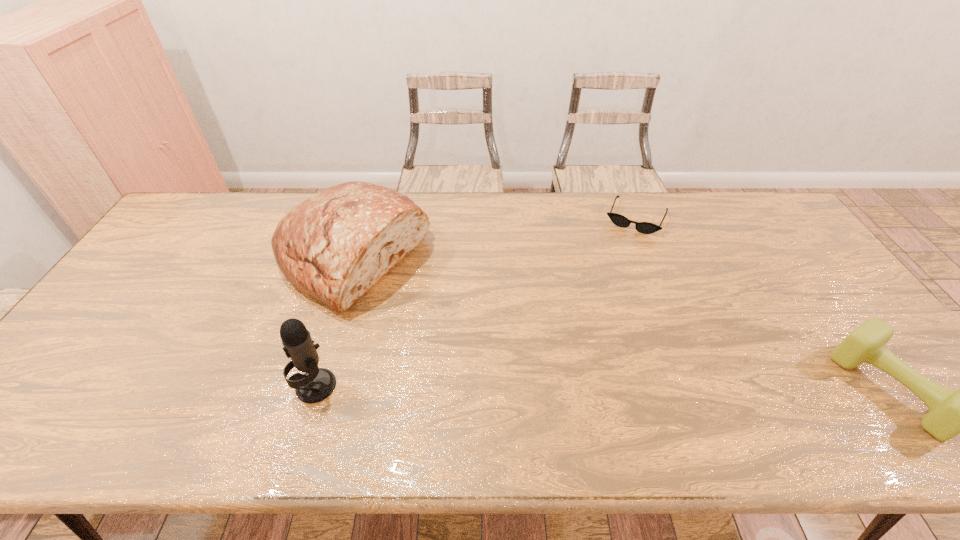
Identify the location of microphone. The width and height of the screenshot is (960, 540). (317, 384).

The image size is (960, 540). Find the location of `bread`. bread is located at coordinates (335, 246).

Image resolution: width=960 pixels, height=540 pixels. I want to click on sunglasses, so pyautogui.click(x=619, y=220).

The height and width of the screenshot is (540, 960). I want to click on the shortest object, so click(619, 220).

Image resolution: width=960 pixels, height=540 pixels. In order to click on blank space located 0.140m on the left of the microphone in this screenshot , I will do `click(237, 386)`.

Where is `free space located 0.070m at the sliced front of the bread`? The image size is (960, 540). free space located 0.070m at the sliced front of the bread is located at coordinates (426, 305).

Where is `vacant space located at the sliced front of the bread`? This screenshot has height=540, width=960. vacant space located at the sliced front of the bread is located at coordinates (451, 320).

Image resolution: width=960 pixels, height=540 pixels. Find the location of `free space located 0.050m at the sliced front of the bread`. free space located 0.050m at the sliced front of the bread is located at coordinates (420, 301).

Image resolution: width=960 pixels, height=540 pixels. Find the location of `free space located 0.260m on the front-facing side of the sunglasses`. free space located 0.260m on the front-facing side of the sunglasses is located at coordinates (606, 287).

Where is `free spot located 0.370m on the front-facing side of the sunglasses`? free spot located 0.370m on the front-facing side of the sunglasses is located at coordinates (594, 313).